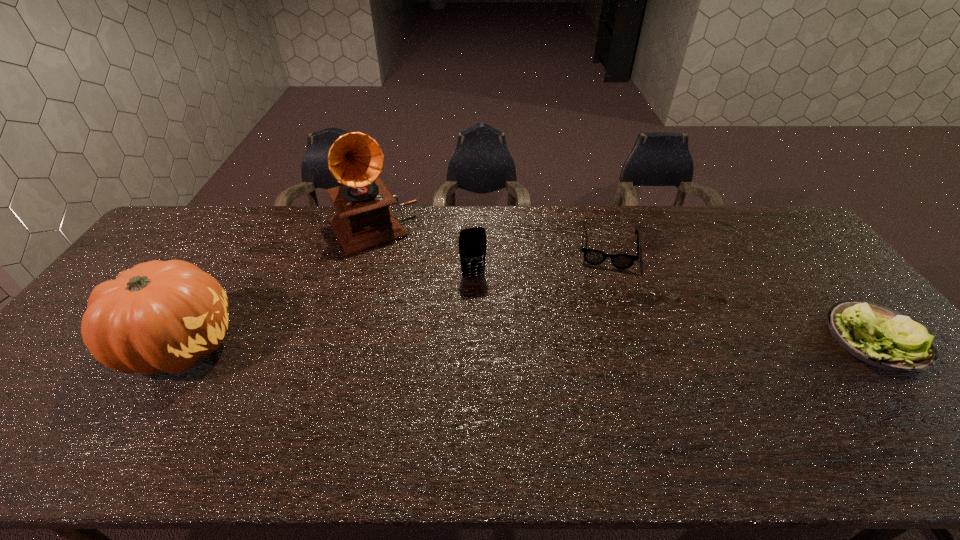
Find the location of `free spot on the desktop that is between the leftmost object and the fourth tallest object and is positioned on the screen of the third tallest object`. free spot on the desktop that is between the leftmost object and the fourth tallest object and is positioned on the screen of the third tallest object is located at coordinates (495, 342).

At what (x,y) coordinates should I click in order to perform the action: click on vacant space on the desktop that is between the leftmost object and the rightmost object and is positioned on the arms of the second object from right to left. Please return your answer as a coordinate pair (x, y). This screenshot has width=960, height=540. Looking at the image, I should click on (602, 341).

The height and width of the screenshot is (540, 960). Identify the location of vacant spot on the desktop that is between the fourth shortest object and the second shortest object and is positioned on the horn of the tallest object. (439, 342).